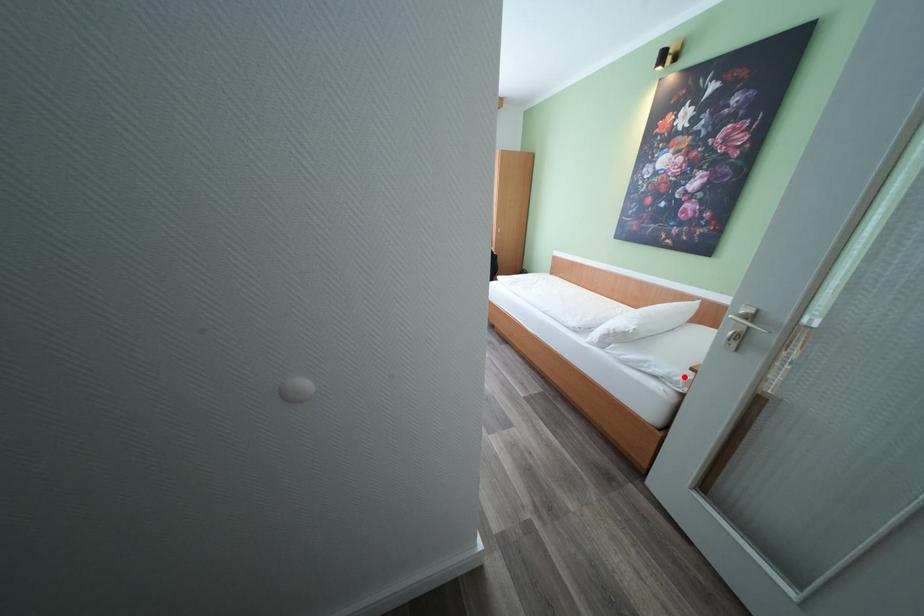
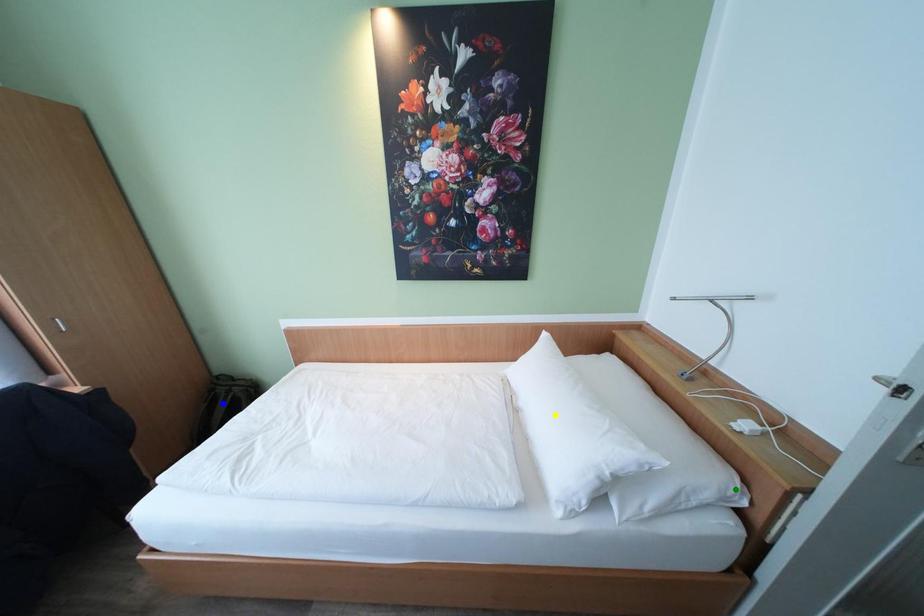
Question: I am providing you with two images of the same scene from different viewpoints. A red point is marked on the first image. You are given multiple points on the second image. Which point in image 2 is actually the same real-world point as the red point in image 1?

Choices:
 (A) yellow point
 (B) green point
 (C) blue point

Answer: (B)